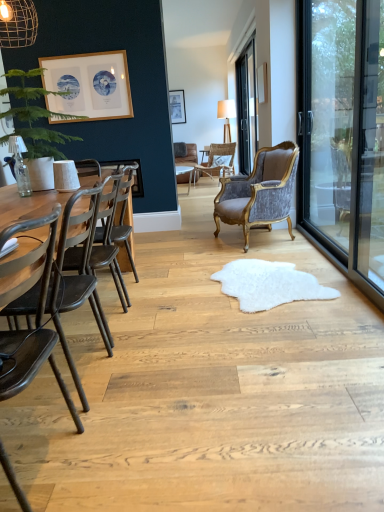
Question: Considering the relative sizes of white glossy round table at center and green matte plant at left in the image provided, is white glossy round table at center thinner than green matte plant at left?

Choices:
 (A) yes
 (B) no

Answer: (A)

Question: Is white glossy round table at center not near green matte plant at left?

Choices:
 (A) yes
 (B) no

Answer: (A)

Question: Is the surface of white glossy round table at center in direct contact with green matte plant at left?

Choices:
 (A) yes
 (B) no

Answer: (B)

Question: Does white glossy round table at center have a smaller size compared to green matte plant at left?

Choices:
 (A) no
 (B) yes

Answer: (B)

Question: From a real-world perspective, is white glossy round table at center positioned over green matte plant at left based on gravity?

Choices:
 (A) no
 (B) yes

Answer: (A)

Question: Does white glossy round table at center have a greater height compared to green matte plant at left?

Choices:
 (A) yes
 (B) no

Answer: (B)

Question: Is wooden textured lamp at center, which is the first lamp from right to left, at the right side of velvet grey armchair at center, which is counted as the 2th chair, starting from the back?

Choices:
 (A) no
 (B) yes

Answer: (B)

Question: From the image's perspective, is wooden textured lamp at center, which is the first lamp from right to left, on top of velvet grey armchair at center, which is counted as the 2th chair, starting from the back?

Choices:
 (A) yes
 (B) no

Answer: (A)

Question: Is the depth of wooden textured lamp at center, which is the first lamp from right to left, greater than that of velvet grey armchair at center, which is counted as the 2th chair, starting from the back?

Choices:
 (A) yes
 (B) no

Answer: (A)

Question: Considering the relative sizes of wooden textured lamp at center, which is the first lamp from right to left, and velvet grey armchair at center, the 3th chair when ordered from front to back, in the image provided, is wooden textured lamp at center, which is the first lamp from right to left, thinner than velvet grey armchair at center, the 3th chair when ordered from front to back,?

Choices:
 (A) yes
 (B) no

Answer: (A)

Question: Is wooden textured lamp at center, the first lamp positioned from the back, positioned far away from velvet grey armchair at center, the 3th chair when ordered from front to back?

Choices:
 (A) no
 (B) yes

Answer: (B)

Question: Considering the relative sizes of wooden textured lamp at center, which is the first lamp from right to left, and velvet grey armchair at center, the 3th chair when ordered from front to back, in the image provided, is wooden textured lamp at center, which is the first lamp from right to left, shorter than velvet grey armchair at center, the 3th chair when ordered from front to back,?

Choices:
 (A) no
 (B) yes

Answer: (A)

Question: Does wooden picture frame at upper right, which ranks as the 3th picture frame in left-to-right order, have a lesser width compared to wooden textured lamp at center, placed as the 2th lamp when sorted from front to back?

Choices:
 (A) yes
 (B) no

Answer: (A)